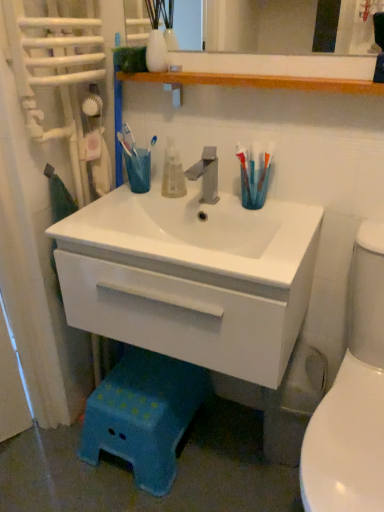
Identify the location of free location in front of translucent plastic toothbrush at right. (289, 226).